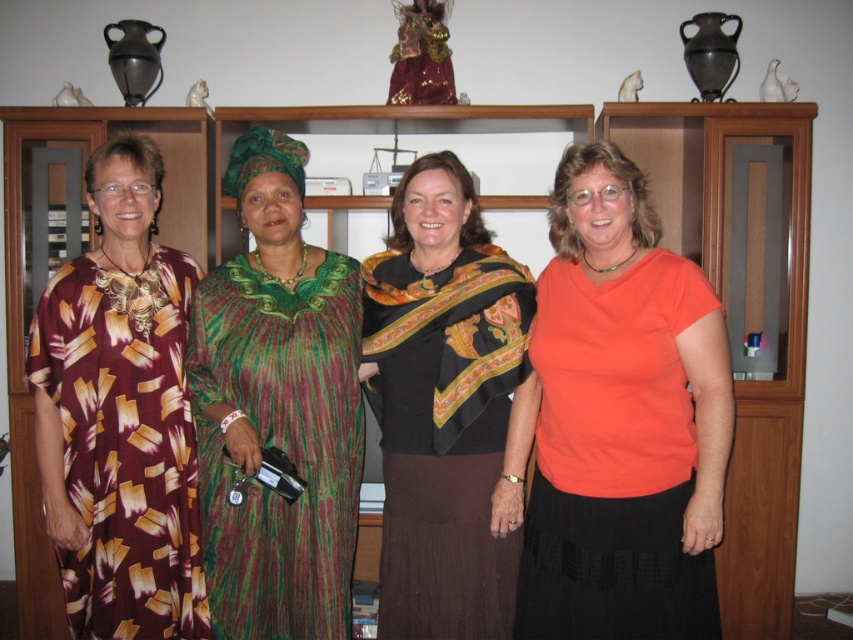
Question: Can you confirm if maroon printed dress at left is bigger than black satin scarf at center?

Choices:
 (A) yes
 (B) no

Answer: (B)

Question: Is green textured dress at center wider than maroon printed dress at left?

Choices:
 (A) no
 (B) yes

Answer: (A)

Question: Does orange matte shirt at center have a larger size compared to maroon printed dress at left?

Choices:
 (A) no
 (B) yes

Answer: (B)

Question: Based on their relative distances, which object is nearer to the black satin scarf at center?

Choices:
 (A) green textured dress at center
 (B) orange matte shirt at center
 (C) maroon printed dress at left

Answer: (A)

Question: Estimate the real-world distances between objects in this image. Which object is farther from the maroon printed dress at left?

Choices:
 (A) orange matte shirt at center
 (B) black satin scarf at center
 (C) green textured dress at center

Answer: (A)

Question: Which of the following is the farthest from the observer?

Choices:
 (A) maroon printed dress at left
 (B) orange matte shirt at center
 (C) black satin scarf at center

Answer: (A)